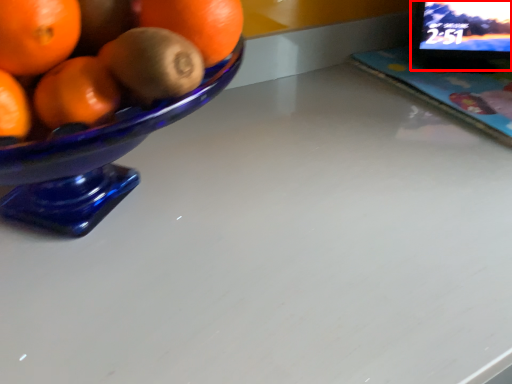
Question: From the image's perspective, what is the correct spatial positioning of computer monitor (annotated by the red box) in reference to laptop?

Choices:
 (A) above
 (B) below

Answer: (A)